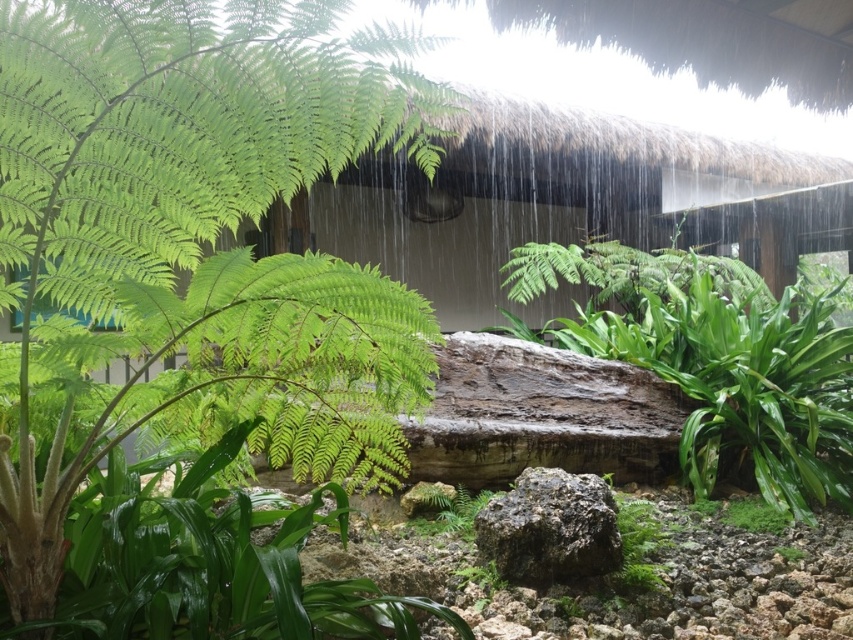
You are a photographer trying to capture the green leafy fern at left and the green mossy rock at center in a single frame. Based on their positions, which object should you focus on first to ensure both are in focus?

The green leafy fern at left is above the green mossy rock at center, so focusing on the green mossy rock at center first will help ensure both are in focus since it is closer to the camera.

You are a gardener who wants to water the green leafy fern at left and the green leafy plant at center. Since it is raining, you need to check which plant is more exposed to the rain. Based on their positions, which one is more likely to get wet first?

The green leafy fern at left is in front of the green leafy plant at center, so it is closer to the rain and will get wet first.